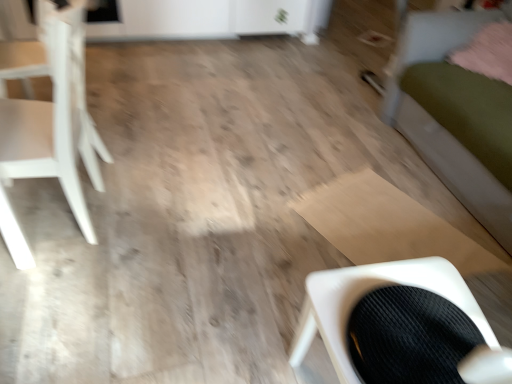
What are the coordinates of `free point below white matte chair at left, which appears as the 1th chair when viewed from the back (from a real-world perspective)` in the screenshot? It's located at (61, 212).